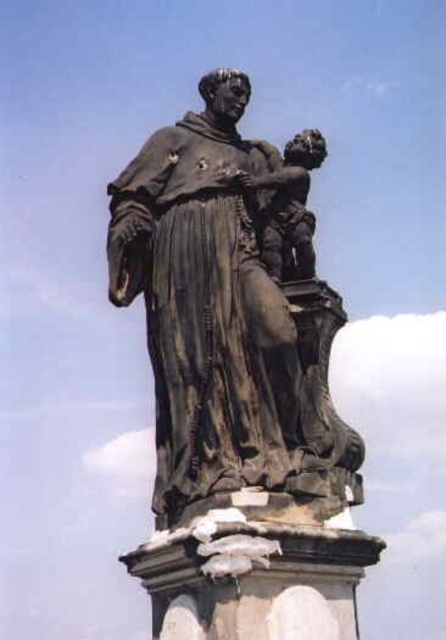
Who is taller, bronze statue at center or bronze statue child at right?

Standing taller between the two is bronze statue at center.

What do you see at coordinates (231, 314) in the screenshot? I see `bronze statue at center` at bounding box center [231, 314].

Is point (271, 244) positioned behind point (289, 170)?

No, it is not.

At what (x,y) coordinates should I click in order to perform the action: click on bronze statue at center. Please return your answer as a coordinate pair (x, y). Looking at the image, I should click on (231, 314).